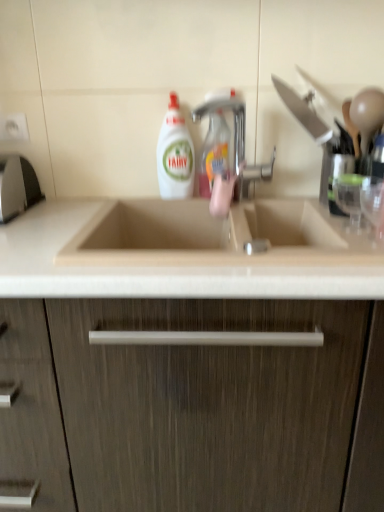
Question: Can you confirm if white plastic electric outlet at upper left is taller than beige marble countertop at center?

Choices:
 (A) no
 (B) yes

Answer: (A)

Question: Is white plastic electric outlet at upper left not close to beige marble countertop at center?

Choices:
 (A) yes
 (B) no

Answer: (B)

Question: Is white plastic electric outlet at upper left turned away from beige marble countertop at center?

Choices:
 (A) no
 (B) yes

Answer: (A)

Question: Considering the relative sizes of white plastic electric outlet at upper left and beige marble countertop at center in the image provided, is white plastic electric outlet at upper left thinner than beige marble countertop at center?

Choices:
 (A) yes
 (B) no

Answer: (A)

Question: From the image's perspective, is white plastic electric outlet at upper left located above beige marble countertop at center?

Choices:
 (A) yes
 (B) no

Answer: (A)

Question: Is white plastic electric outlet at upper left not within beige marble countertop at center?

Choices:
 (A) no
 (B) yes

Answer: (B)

Question: Is translucent plastic spray bottle at center, which is counted as the second cleaning product, starting from the left, at the back of silver metallic faucet at center?

Choices:
 (A) yes
 (B) no

Answer: (A)

Question: Can you confirm if silver metallic faucet at center is shorter than translucent plastic spray bottle at center, the first cleaning product positioned from the right?

Choices:
 (A) no
 (B) yes

Answer: (A)

Question: Would you say silver metallic faucet at center is a long distance from translucent plastic spray bottle at center, the first cleaning product positioned from the right?

Choices:
 (A) no
 (B) yes

Answer: (A)

Question: Does silver metallic faucet at center come behind translucent plastic spray bottle at center, the first cleaning product positioned from the right?

Choices:
 (A) yes
 (B) no

Answer: (B)

Question: Is translucent plastic spray bottle at center, the first cleaning product positioned from the right, surrounded by silver metallic faucet at center?

Choices:
 (A) yes
 (B) no

Answer: (B)

Question: From the image's perspective, is silver metallic faucet at center on top of translucent plastic spray bottle at center, the first cleaning product positioned from the right?

Choices:
 (A) no
 (B) yes

Answer: (A)

Question: From a real-world perspective, is translucent plastic spray bottle at center, which is counted as the second cleaning product, starting from the left, physically above white glossy liquid at center, the second cleaning product in the right-to-left sequence?

Choices:
 (A) no
 (B) yes

Answer: (B)